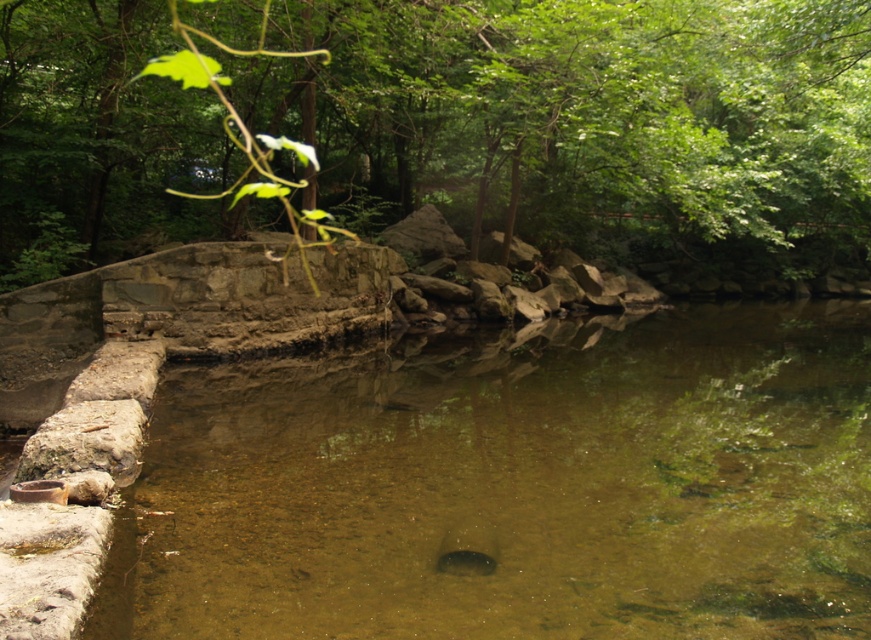
You are standing at the edge of the pond and want to reach a specific point marked at coordinates point (x=403, y=376). If your maximum comfortable walking distance is 10 meters, can you comfortably walk to that point without needing assistance?

The distance of point (x=403, y=376) from viewer is 12.07 meters, which exceeds your maximum comfortable walking distance of 10 meters. Therefore, you would need assistance or may not be able to comfortably reach that point.

Looking at this image, you are a landscape architect designing a walking path that needs to pass between the clear water at center and the green leafy tree at upper center. The path must be at least 8 meters wide to accommodate visitors comfortably. Based on the scene, will the existing space between these two features allow for this width?

The clear water at center is 7.54 meters from the green leafy tree at upper center, which is less than the required 8 meters. Therefore, the existing space is insufficient for the path.

You are standing at the edge of the pond and want to observe the clear water at center and the green leafy tree at upper center. Which object is nearer to you?

The clear water at center is closer to the viewer than the green leafy tree at upper center.